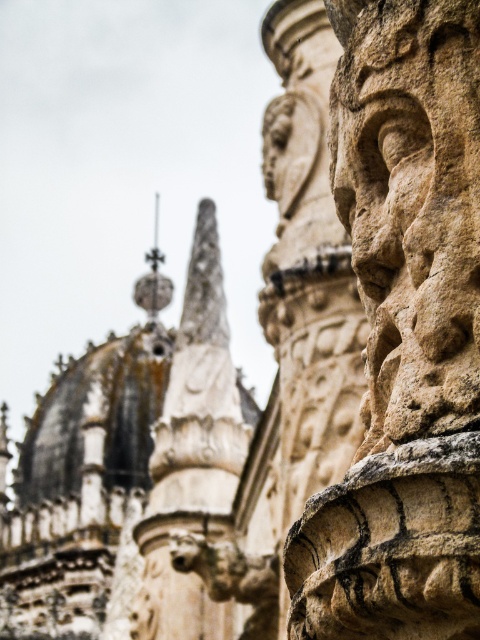
Question: Which of the following is the closest to the observer?

Choices:
 (A) stone textured face at right
 (B) white stone spire at upper center
 (C) polished silver spire at center

Answer: (A)

Question: From the image, what is the correct spatial relationship of stone textured face at right in relation to polished silver spire at center?

Choices:
 (A) left
 (B) right

Answer: (B)

Question: Is stone textured face at right further to camera compared to polished silver spire at center?

Choices:
 (A) no
 (B) yes

Answer: (A)

Question: Among these objects, which one is nearest to the camera?

Choices:
 (A) stone textured face at right
 (B) white stone spire at upper center

Answer: (A)

Question: Is white stone spire at upper center below polished silver spire at center?

Choices:
 (A) yes
 (B) no

Answer: (A)

Question: Which point is closer to the camera?

Choices:
 (A) (156, 285)
 (B) (140, 525)

Answer: (B)